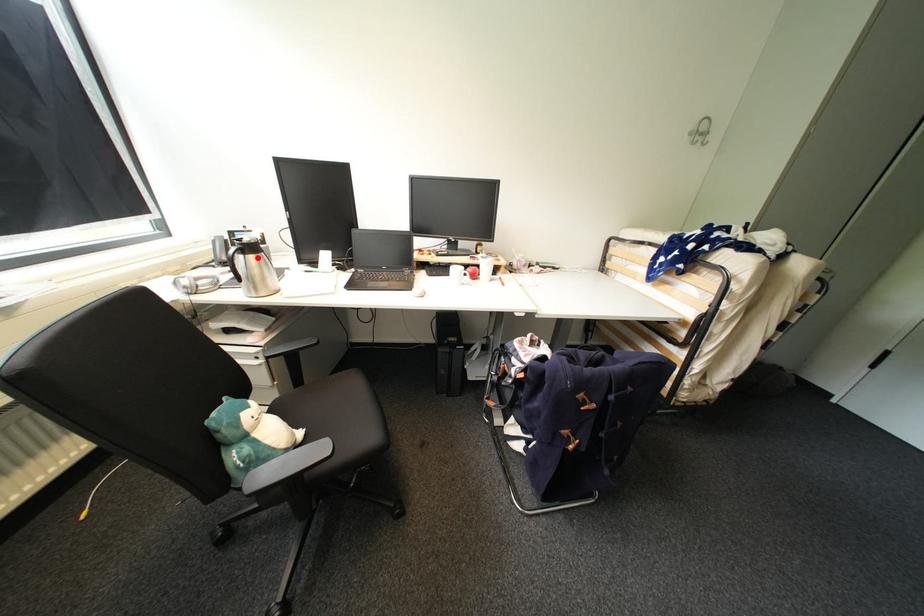
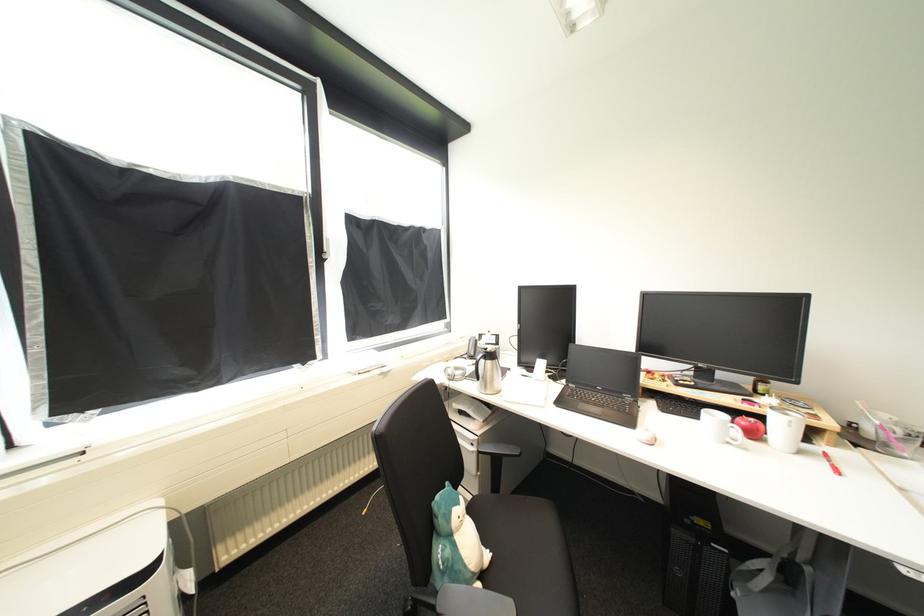
Question: I am providing you with two images of the same scene from different viewpoints. Given a red point in image1, look at the same physical point in image2. Is it:

Choices:
 (A) Closer to the viewpoint
 (B) Farther from the viewpoint

Answer: (B)